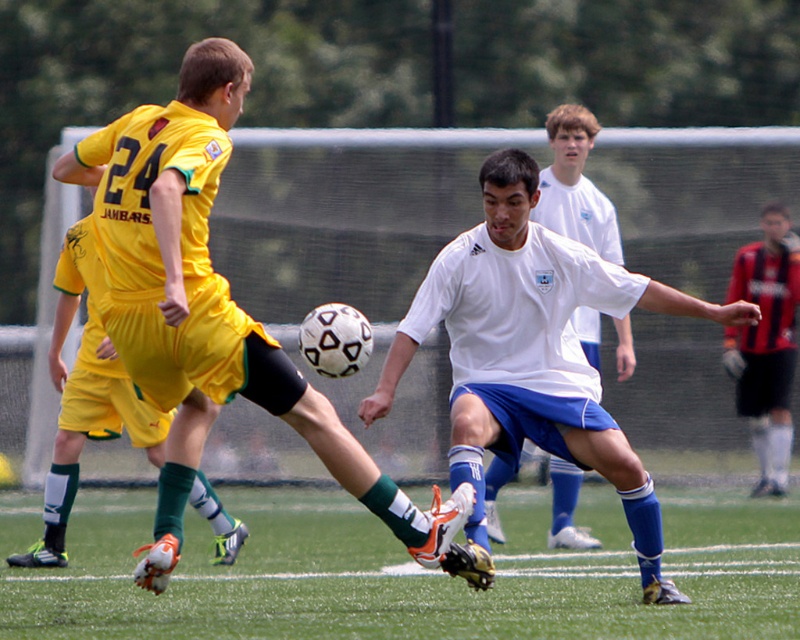
You are a soccer coach analyzing the play. You notice two players wearing matte yellow shorts at center and matte yellow shorts at left. Which player is positioned closer to the front of the field?

The matte yellow shorts at center is positioned in front of the matte yellow shorts at left, so the player with matte yellow shorts at center is closer to the front of the field.

You are a soccer coach analyzing the game. You notice a point at coordinates (214, 312) on the field. Based on the scene description, which object is located at this point?

The point at coordinates (214, 312) is on the matte yellow shorts at center.